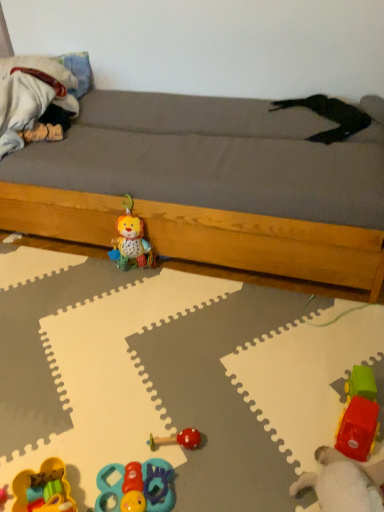
Where is `vacant space that is in between plush fabric lion at center, the 2th toy when ordered from left to right, and smooth plastic rattle at center, the 3th toy viewed from the right`? Image resolution: width=384 pixels, height=512 pixels. vacant space that is in between plush fabric lion at center, the 2th toy when ordered from left to right, and smooth plastic rattle at center, the 3th toy viewed from the right is located at coordinates (153, 336).